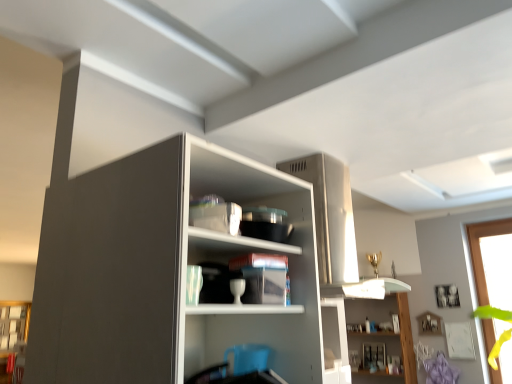
Question: From the image's perspective, does transparent glass window at right appear lower than white glossy shelf at upper center, arranged as the second shelf when viewed from the top?

Choices:
 (A) yes
 (B) no

Answer: (B)

Question: Does transparent glass window at right have a smaller size compared to white glossy shelf at upper center, placed as the 1th shelf when sorted from back to front?

Choices:
 (A) no
 (B) yes

Answer: (A)

Question: Does transparent glass window at right have a greater width compared to white glossy shelf at upper center, the 1th shelf ordered from the bottom?

Choices:
 (A) yes
 (B) no

Answer: (A)

Question: Is transparent glass window at right looking in the opposite direction of white glossy shelf at upper center, acting as the second shelf starting from the front?

Choices:
 (A) yes
 (B) no

Answer: (B)

Question: Considering the relative sizes of transparent glass window at right and white glossy shelf at upper center, which ranks as the 1th shelf in right-to-left order, in the image provided, is transparent glass window at right bigger than white glossy shelf at upper center, which ranks as the 1th shelf in right-to-left order,?

Choices:
 (A) no
 (B) yes

Answer: (B)

Question: Does transparent glass window at right have a lesser width compared to white glossy shelf at upper center, which ranks as the 1th shelf in right-to-left order?

Choices:
 (A) yes
 (B) no

Answer: (B)

Question: From a real-world perspective, is white glossy shelf at upper center, which ranks as the 1th shelf in right-to-left order, over transparent glass window at right?

Choices:
 (A) no
 (B) yes

Answer: (A)

Question: Is white glossy shelf at upper center, acting as the second shelf starting from the front, outside transparent glass window at right?

Choices:
 (A) no
 (B) yes

Answer: (B)

Question: Does white glossy shelf at upper center, which ranks as the 1th shelf in right-to-left order, have a lesser height compared to transparent glass window at right?

Choices:
 (A) no
 (B) yes

Answer: (B)

Question: Is the position of white glossy shelf at upper center, which ranks as the 1th shelf in right-to-left order, less distant than that of transparent glass window at right?

Choices:
 (A) no
 (B) yes

Answer: (A)

Question: Considering the relative sizes of white glossy shelf at upper center, arranged as the second shelf when viewed from the top, and transparent glass window at right in the image provided, is white glossy shelf at upper center, arranged as the second shelf when viewed from the top, smaller than transparent glass window at right?

Choices:
 (A) yes
 (B) no

Answer: (A)

Question: Is transparent glass window at right surrounded by white glossy shelf at upper center, arranged as the second shelf when viewed from the top?

Choices:
 (A) yes
 (B) no

Answer: (B)

Question: Is transparent glass window at right closer to camera compared to matte cardboard box at center, which ranks as the 1th shelf in front-to-back order?

Choices:
 (A) yes
 (B) no

Answer: (B)